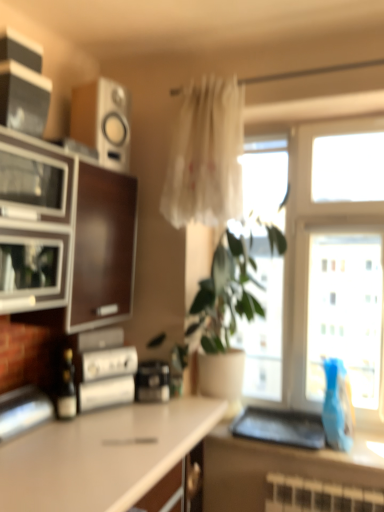
Find the location of a particular element. This screenshot has height=512, width=384. free location in front of black plastic toaster at center, which is the 3th appliance from top to bottom is located at coordinates (159, 412).